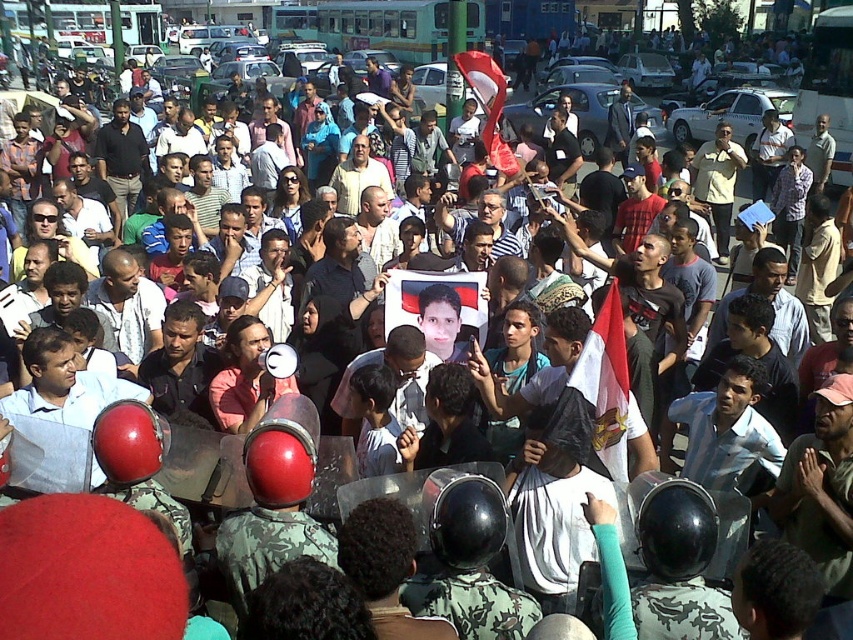
Question: Which point is closer to the camera taking this photo?

Choices:
 (A) (577, 362)
 (B) (413, 324)

Answer: (A)

Question: Does white fabric flag at center appear on the right side of red fabric flag at center?

Choices:
 (A) no
 (B) yes

Answer: (B)

Question: Is white fabric flag at center above red fabric flag at center?

Choices:
 (A) no
 (B) yes

Answer: (A)

Question: Considering the relative positions of white fabric flag at center and red fabric flag at center in the image provided, where is white fabric flag at center located with respect to red fabric flag at center?

Choices:
 (A) right
 (B) left

Answer: (A)

Question: Among these objects, which one is nearest to the camera?

Choices:
 (A) red fabric flag at center
 (B) white fabric flag at center

Answer: (B)